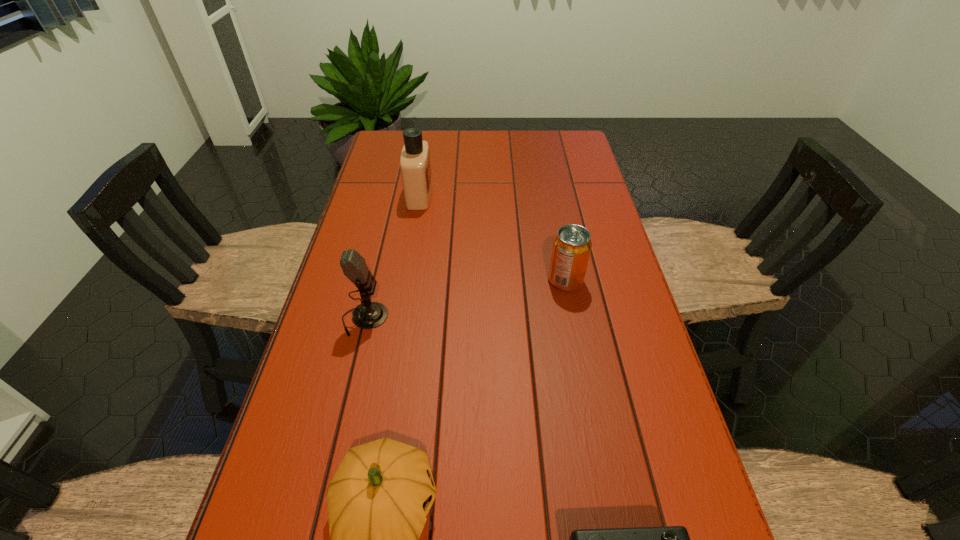
This screenshot has width=960, height=540. Identify the location of the farthest object. (415, 164).

Identify the location of microphone. The height and width of the screenshot is (540, 960). (368, 315).

I want to click on the second farthest object, so click(x=572, y=244).

Find the location of a particular element. This screenshot has height=540, width=960. vacant region located on the front label of the farthest object is located at coordinates (475, 195).

At what (x,y) coordinates should I click in order to perform the action: click on free space located 0.220m on the front-facing side of the third farthest object. Please return your answer as a coordinate pair (x, y). This screenshot has height=540, width=960. Looking at the image, I should click on (480, 319).

You are a GUI agent. You are given a task and a screenshot of the screen. Output one action in this format:
    pyautogui.click(x=<x>, y=<y>)
    Task: Click on the vacant area situated 0.090m on the back of the soda can
    The image size is (960, 540).
    Given the screenshot: What is the action you would take?
    pyautogui.click(x=559, y=246)

At what (x,y) coordinates should I click in order to perform the action: click on perfume that is at the left edge. Please return your answer as a coordinate pair (x, y). Looking at the image, I should click on (415, 164).

Locate an element on the screen. Image resolution: width=960 pixels, height=540 pixels. microphone present at the left edge is located at coordinates (368, 315).

At what (x,y) coordinates should I click in order to perform the action: click on object that is at the right edge. Please return your answer as a coordinate pair (x, y). The width and height of the screenshot is (960, 540). Looking at the image, I should click on (572, 244).

Where is `vacant space at the left edge of the desktop`? This screenshot has width=960, height=540. vacant space at the left edge of the desktop is located at coordinates (381, 291).